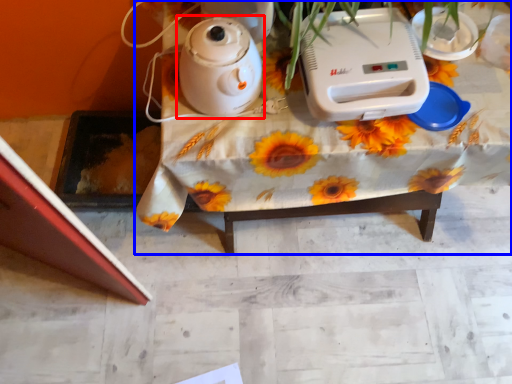
Question: Among these objects, which one is nearest to the camera, kettle (highlighted by a red box) or table (highlighted by a blue box)?

Choices:
 (A) kettle
 (B) table

Answer: (A)